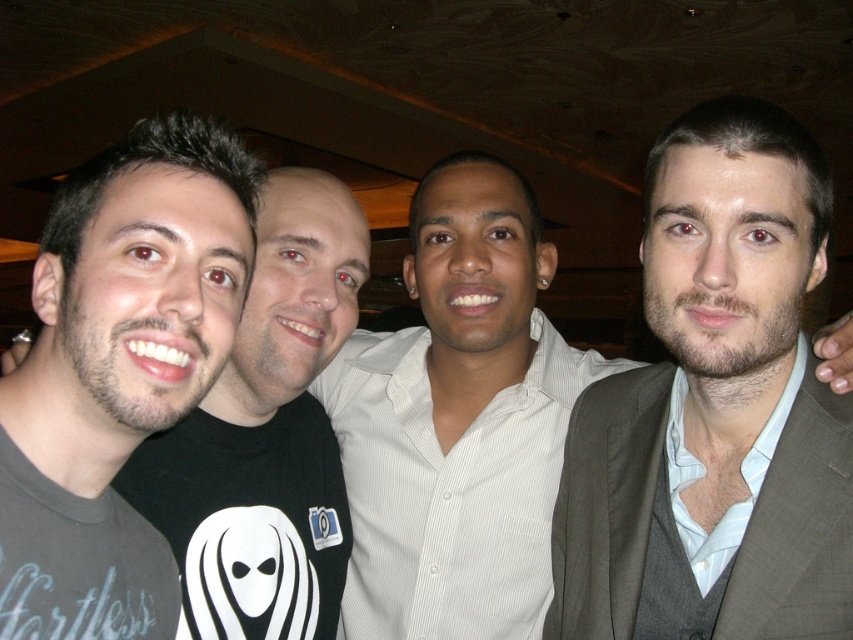
Question: Which point is closer to the camera?

Choices:
 (A) (51, 426)
 (B) (815, 612)

Answer: (A)

Question: Which point is closer to the camera?

Choices:
 (A) (160, 220)
 (B) (718, 605)

Answer: (A)

Question: Is light brown suit at right below gray matte t-shirt at left?

Choices:
 (A) yes
 (B) no

Answer: (A)

Question: Is light brown suit at right wider than gray matte t-shirt at left?

Choices:
 (A) yes
 (B) no

Answer: (A)

Question: Can you confirm if light brown suit at right is bigger than gray matte t-shirt at left?

Choices:
 (A) no
 (B) yes

Answer: (B)